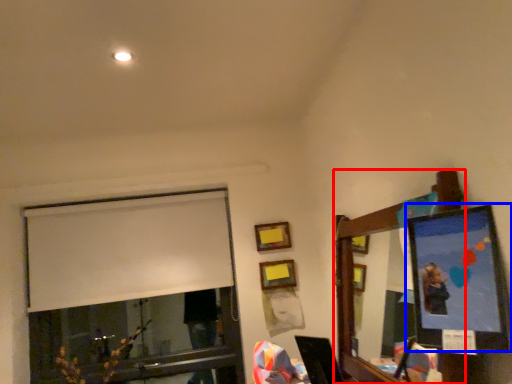
Question: Which of the following is the farthest to the observer, mirror (highlighted by a red box) or picture frame (highlighted by a blue box)?

Choices:
 (A) mirror
 (B) picture frame

Answer: (A)